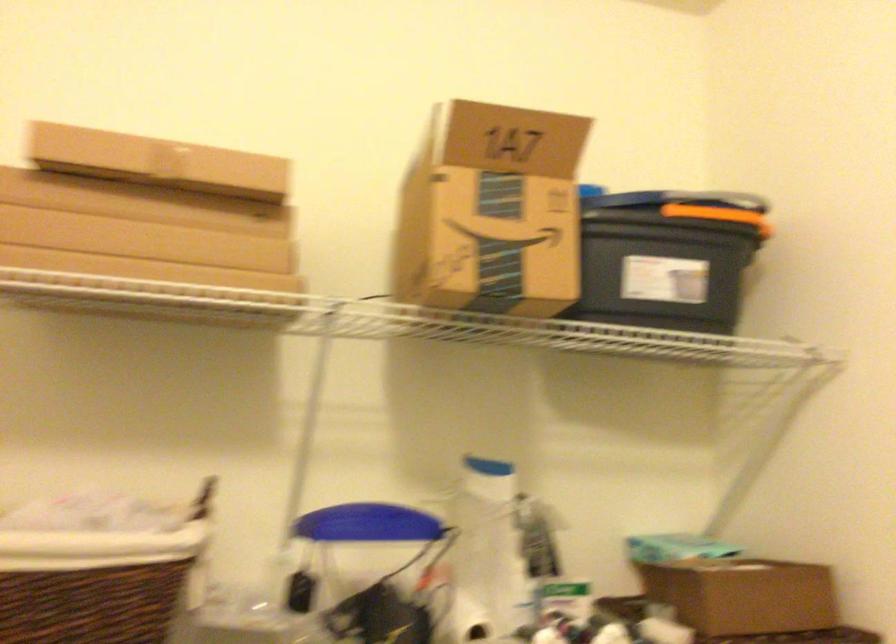
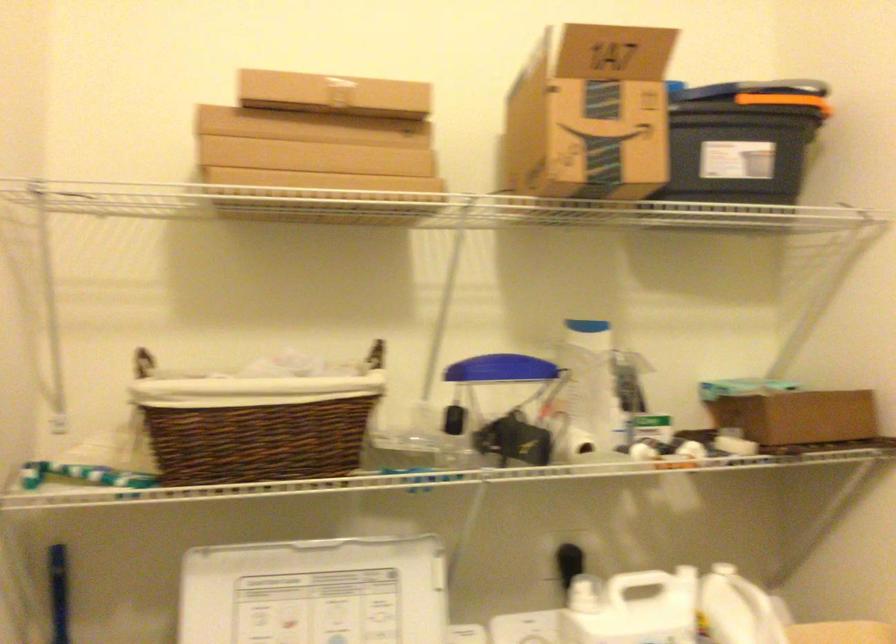
Question: The images are taken continuously from a first-person perspective. In which direction is your viewpoint rotating?

Choices:
 (A) Left
 (B) Right
 (C) Up
 (D) Down

Answer: (D)